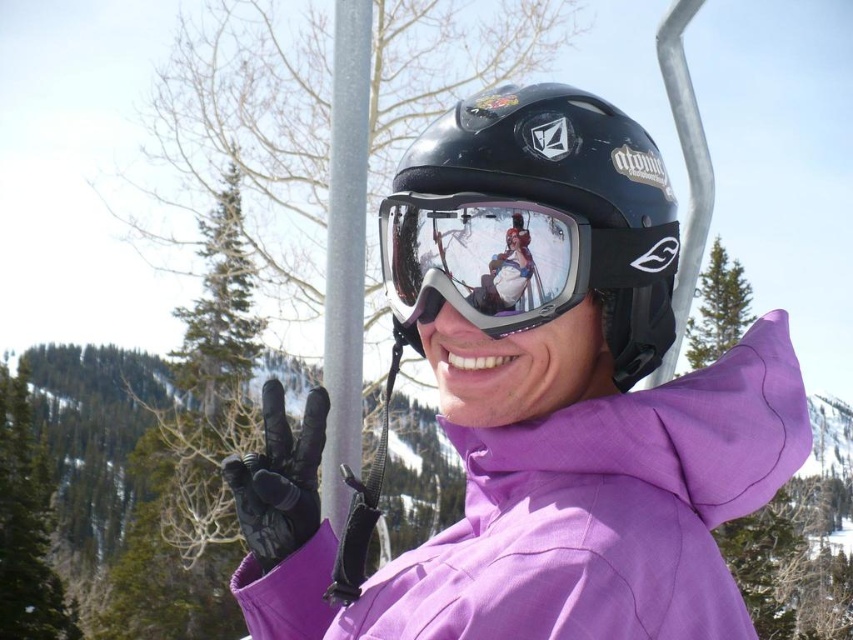
Is black matte helmet at center closer to camera compared to transparent plastic goggles at center?

No, black matte helmet at center is further to the viewer.

Can you confirm if black matte helmet at center is bigger than transparent plastic goggles at center?

Indeed, black matte helmet at center has a larger size compared to transparent plastic goggles at center.

You are a GUI agent. You are given a task and a screenshot of the screen. Output one action in this format:
    pyautogui.click(x=<x>, y=<y>)
    Task: Click on the black matte helmet at center
    The image size is (853, 640).
    Given the screenshot: What is the action you would take?
    pyautogui.click(x=534, y=221)

At what (x,y) coordinates should I click in order to perform the action: click on black matte helmet at center. Please return your answer as a coordinate pair (x, y). The image size is (853, 640). Looking at the image, I should click on (534, 221).